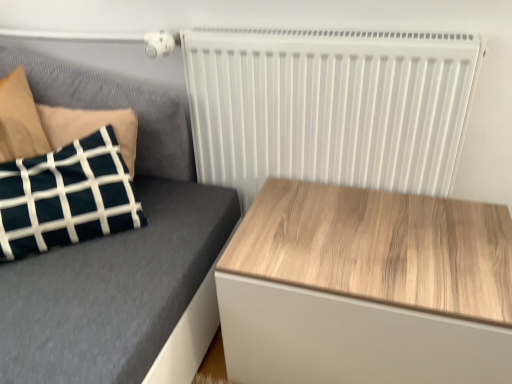
Describe the element at coordinates (366, 288) in the screenshot. This screenshot has height=384, width=512. I see `wooden table at right` at that location.

The height and width of the screenshot is (384, 512). I want to click on wooden table at right, so click(x=366, y=288).

In order to click on white matte radiator at upper right in this screenshot , I will do `click(329, 106)`.

Locate an element on the screen. wooden table at right is located at coordinates (366, 288).

Between point (127, 238) and point (340, 31), which one is positioned behind?

Point (127, 238)

Based on their sizes in the image, would you say velvet dark blue pillow at left is bigger or smaller than white matte radiator at upper right?

velvet dark blue pillow at left is bigger than white matte radiator at upper right.

Could you tell me if velvet dark blue pillow at left is facing white matte radiator at upper right?

No, velvet dark blue pillow at left is not aimed at white matte radiator at upper right.

Does velvet dark blue pillow at left contain white matte radiator at upper right?

No, white matte radiator at upper right is located outside of velvet dark blue pillow at left.

Which object is closer to the camera, white matte radiator at upper right or velvet dark blue pillow at left?

velvet dark blue pillow at left is closer to the camera.

Considering the points (246, 130) and (167, 256), which point is in front, point (246, 130) or point (167, 256)?

The point (167, 256) is in front.

Is white matte radiator at upper right not close to velvet dark blue pillow at left?

Actually, white matte radiator at upper right and velvet dark blue pillow at left are a little close together.

Does velvet dark blue pillow at left have a greater width compared to wooden table at right?

No, velvet dark blue pillow at left is not wider than wooden table at right.

From a real-world perspective, who is located lower, velvet dark blue pillow at left or wooden table at right?

wooden table at right, from a real-world perspective.

Is velvet dark blue pillow at left turned away from wooden table at right?

No, velvet dark blue pillow at left's orientation is not away from wooden table at right.

Is the depth of wooden table at right less than that of velvet dark blue pillow at left?

Yes, the depth of wooden table at right is less than that of velvet dark blue pillow at left.

Is wooden table at right wider than velvet dark blue pillow at left?

Indeed, wooden table at right has a greater width compared to velvet dark blue pillow at left.

Where is `table below the velvet dark blue pillow at left (from the image's perspective)`? table below the velvet dark blue pillow at left (from the image's perspective) is located at coordinates point(366,288).

From the image's perspective, between wooden table at right and velvet dark blue pillow at left, who is located below?

wooden table at right appears lower in the image.

Considering their positions, is white matte radiator at upper right located in front of or behind wooden table at right?

white matte radiator at upper right is positioned farther from the viewer than wooden table at right.

From a real-world perspective, is white matte radiator at upper right beneath wooden table at right?

Incorrect, from a real-world perspective, white matte radiator at upper right is higher than wooden table at right.

From the image's perspective, relative to wooden table at right, is white matte radiator at upper right above or below?

white matte radiator at upper right is above wooden table at right.

Does white matte radiator at upper right turn towards wooden table at right?

Yes, white matte radiator at upper right is oriented towards wooden table at right.

Considering the relative sizes of wooden table at right and white matte radiator at upper right in the image provided, is wooden table at right thinner than white matte radiator at upper right?

Incorrect, the width of wooden table at right is not less than that of white matte radiator at upper right.

Consider the image. From a real-world perspective, is wooden table at right positioned above or below white matte radiator at upper right?

wooden table at right is situated lower than white matte radiator at upper right in the real world.

From the image's perspective, does wooden table at right appear lower than white matte radiator at upper right?

Correct, wooden table at right appears lower than white matte radiator at upper right in the image.

Locate an element on the screen. table on the right of the white matte radiator at upper right is located at coordinates (366, 288).

Image resolution: width=512 pixels, height=384 pixels. Identify the location of radiator above the velvet dark blue pillow at left (from the image's perspective). (329, 106).

Where is `furniture below the white matte radiator at upper right (from a real-world perspective)`? furniture below the white matte radiator at upper right (from a real-world perspective) is located at coordinates [113, 249].

Looking at the image, which one is located closer to wooden table at right, velvet dark blue pillow at left or white matte radiator at upper right?

Among the two, white matte radiator at upper right is located nearer to wooden table at right.

Looking at the image, which one is located further to wooden table at right, white matte radiator at upper right or velvet dark blue pillow at left?

Based on the image, velvet dark blue pillow at left appears to be further to wooden table at right.

From the image, which object appears to be nearer to white matte radiator at upper right, wooden table at right or velvet dark blue pillow at left?

Among the two, wooden table at right is located nearer to white matte radiator at upper right.

Which object lies further to the anchor point white matte radiator at upper right, velvet dark blue pillow at left or wooden table at right?

Among the two, velvet dark blue pillow at left is located further to white matte radiator at upper right.

Based on their spatial positions, is white matte radiator at upper right or wooden table at right further from velvet dark blue pillow at left?

wooden table at right.

When comparing their distances from velvet dark blue pillow at left, does wooden table at right or white matte radiator at upper right seem further?

wooden table at right lies further to velvet dark blue pillow at left than the other object.

You are a GUI agent. You are given a task and a screenshot of the screen. Output one action in this format:
    pyautogui.click(x=<x>, y=<y>)
    Task: Click on the radiator situated between velvet dark blue pillow at left and wooden table at right from left to right
    Image resolution: width=512 pixels, height=384 pixels.
    Given the screenshot: What is the action you would take?
    pyautogui.click(x=329, y=106)